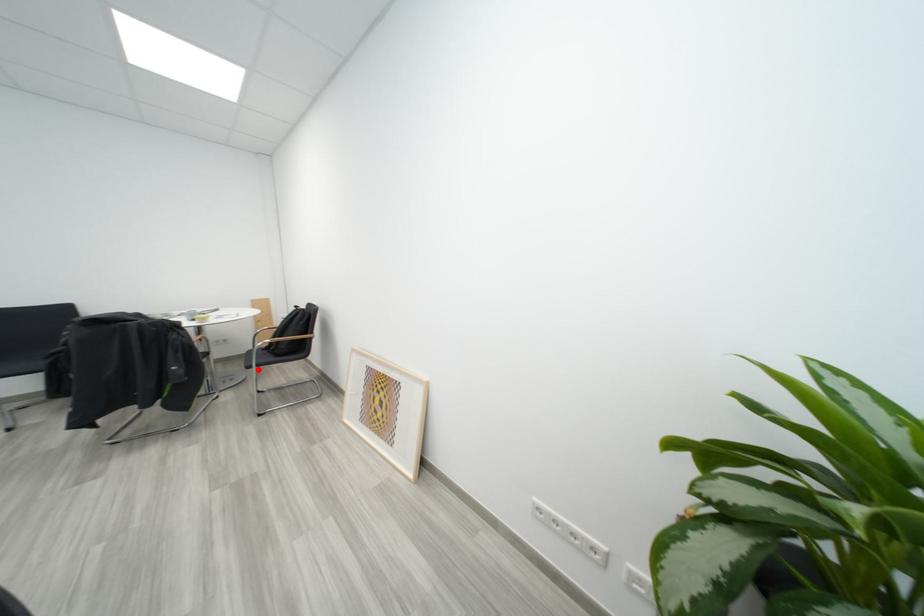
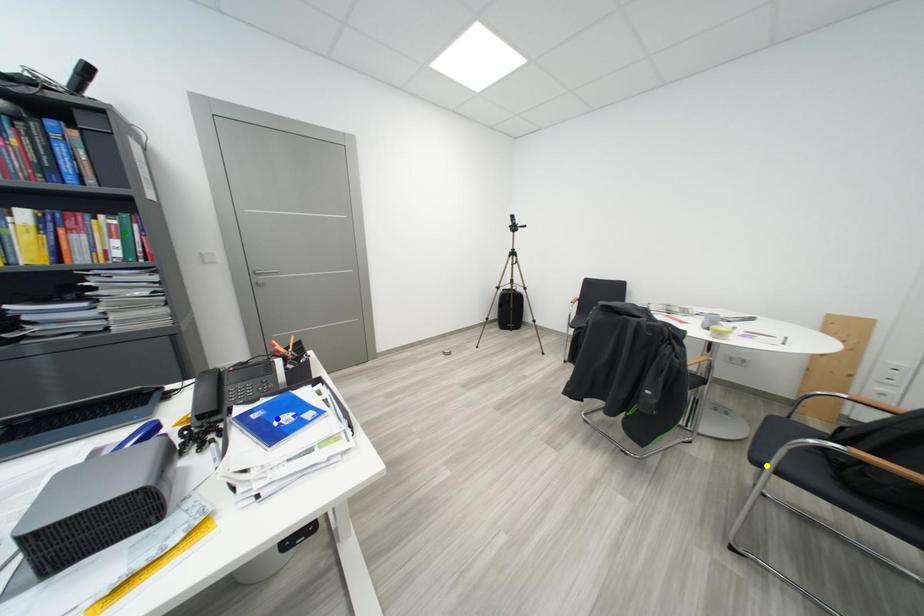
Question: I am providing you with two images of the same scene from different viewpoints. A red point is marked on the first image. You are given multiple points on the second image. Which point in image 2 is actually the same real-world point as the red point in image 1?

Choices:
 (A) blue point
 (B) yellow point
 (C) green point

Answer: (B)